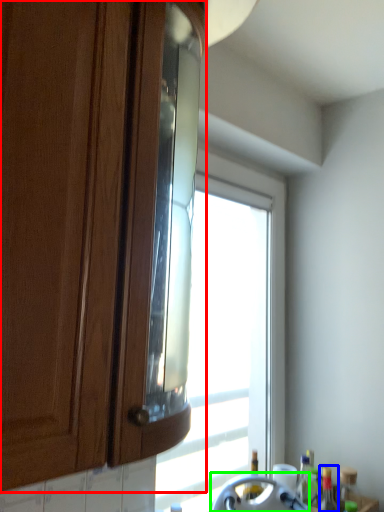
Question: Which object is the farthest from cabinetry (highlighted by a red box)? Choose among these: bottle (highlighted by a blue box) or appliance (highlighted by a green box).

Choices:
 (A) bottle
 (B) appliance

Answer: (A)